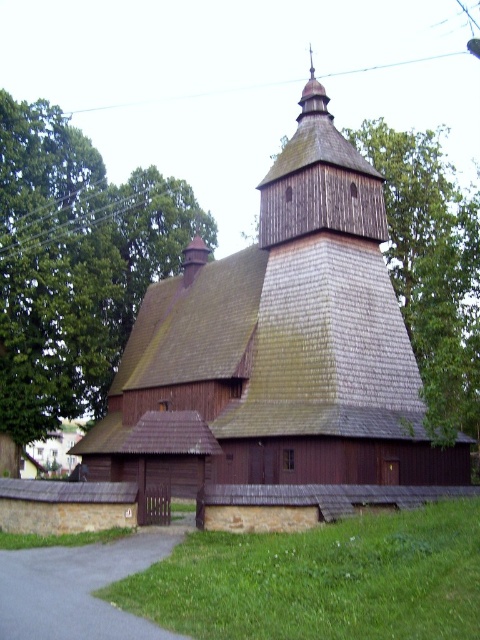
Question: Is brown wooden church at center closer to the viewer compared to brown wooden tree at upper left?

Choices:
 (A) no
 (B) yes

Answer: (B)

Question: Among these objects, which one is nearest to the camera?

Choices:
 (A) brown wooden church at center
 (B) brown wooden tree at upper left

Answer: (A)

Question: From the image, what is the correct spatial relationship of brown wooden church at center in relation to brown wooden tree at upper left?

Choices:
 (A) right
 (B) left

Answer: (A)

Question: Which point is closer to the camera taking this photo?

Choices:
 (A) (79, 298)
 (B) (400, 444)

Answer: (B)

Question: Is brown wooden church at center positioned behind brown wooden tree at upper left?

Choices:
 (A) no
 (B) yes

Answer: (A)